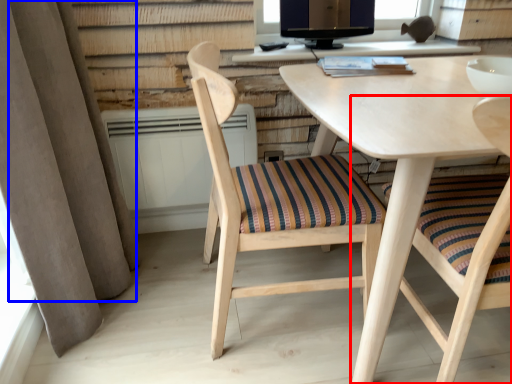
Question: Which of the following is the closest to the observer, chair (highlighted by a red box) or curtain (highlighted by a blue box)?

Choices:
 (A) chair
 (B) curtain

Answer: (A)